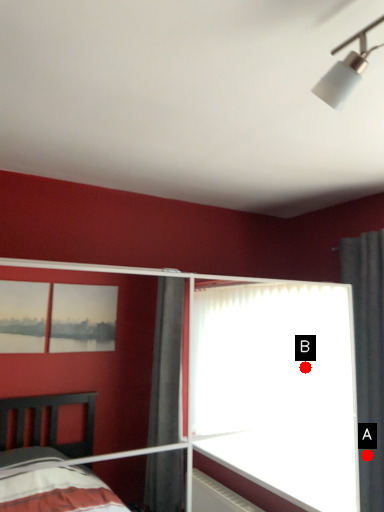
Question: Two points are circled on the image, labeled by A and B beside each circle. Among these points, which one is farthest from the camera?

Choices:
 (A) A is further
 (B) B is further

Answer: (B)